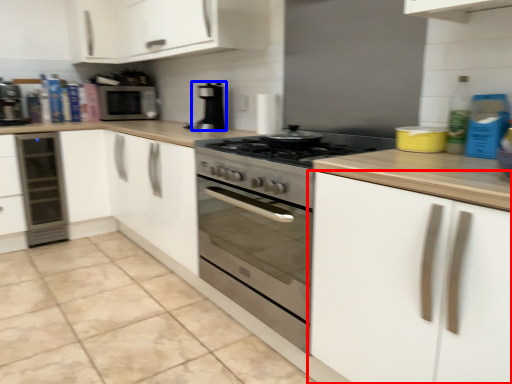
Question: Which object appears closest to the camera in this image, cabinetry (highlighted by a red box) or kitchen appliance (highlighted by a blue box)?

Choices:
 (A) cabinetry
 (B) kitchen appliance

Answer: (A)